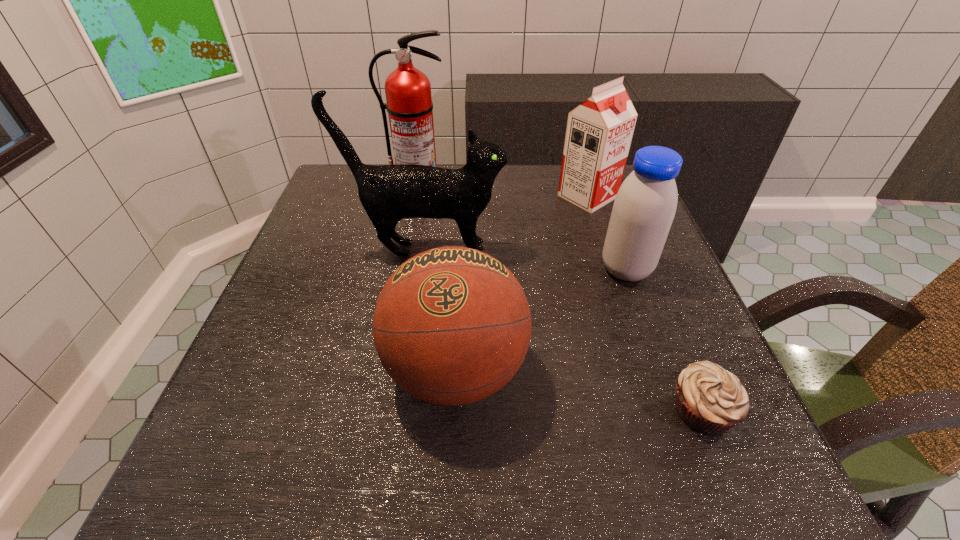
At what (x,y) coordinates should I click in order to perform the action: click on vacant region located 0.060m on the left of the basketball. Please return your answer as a coordinate pair (x, y). Image resolution: width=960 pixels, height=540 pixels. Looking at the image, I should click on (351, 371).

Where is `vacant space located on the left of the muffin`? This screenshot has width=960, height=540. vacant space located on the left of the muffin is located at coordinates (607, 410).

The height and width of the screenshot is (540, 960). I want to click on fire extinguisher that is positioned at the far edge, so click(x=409, y=104).

This screenshot has width=960, height=540. In order to click on soya milk that is positioned at the far edge in this screenshot , I will do `click(599, 132)`.

Identify the location of fire extinguisher positioned at the left edge. (409, 104).

Where is `cat situated at the left edge`? This screenshot has height=540, width=960. cat situated at the left edge is located at coordinates (390, 193).

I want to click on muffin at the right edge, so click(710, 400).

You are a GUI agent. You are given a task and a screenshot of the screen. Output one action in this format:
    pyautogui.click(x=<x>, y=<y>)
    Task: Click on the object that is at the far left corner
    
    Given the screenshot: What is the action you would take?
    coord(409,104)

Identify the location of object that is at the far right corner. (599, 132).

Identify the location of free space at the far edge. Image resolution: width=960 pixels, height=540 pixels. (497, 191).